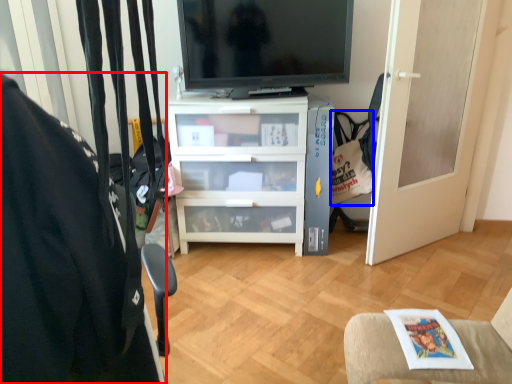
Question: Which object appears closest to the camera in this image, furniture (highlighted by a red box) or handbag (highlighted by a blue box)?

Choices:
 (A) furniture
 (B) handbag

Answer: (A)